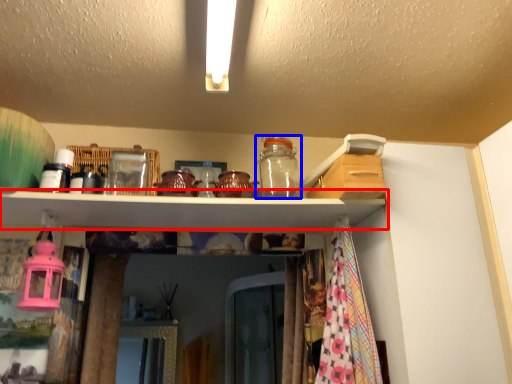
Question: Which object is further to the camera taking this photo, shelf (highlighted by a red box) or glass jar (highlighted by a blue box)?

Choices:
 (A) shelf
 (B) glass jar

Answer: (B)